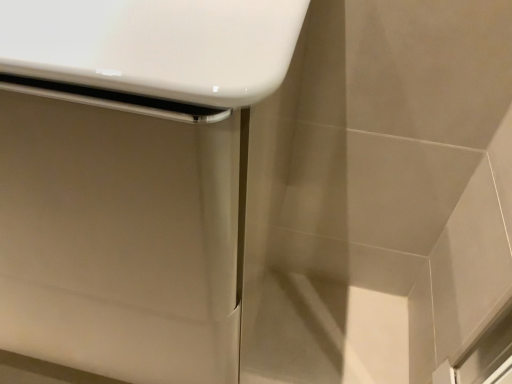
Describe the element at coordinates (130, 179) in the screenshot. Image resolution: width=512 pixels, height=384 pixels. I see `white glossy refrigerator at upper left` at that location.

What is the approximate height of white glossy refrigerator at upper left?

white glossy refrigerator at upper left is 50.20 centimeters in height.

The height and width of the screenshot is (384, 512). Find the location of `white glossy refrigerator at upper left`. white glossy refrigerator at upper left is located at coordinates (130, 179).

From the picture: In order to face white glossy refrigerator at upper left, should I rotate leftwards or rightwards?

You should look left and rotate roughly 26.220 degrees.

The image size is (512, 384). I want to click on white glossy refrigerator at upper left, so click(x=130, y=179).